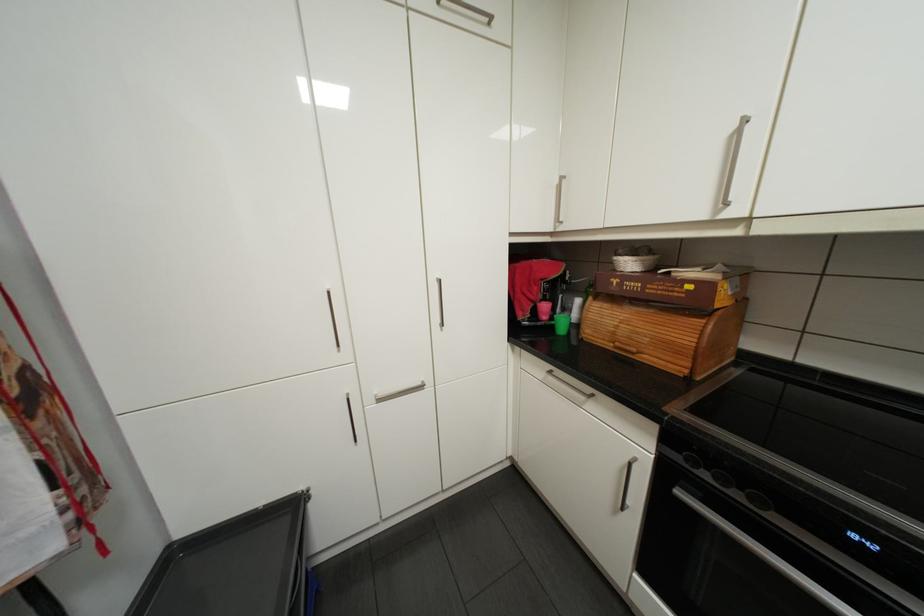
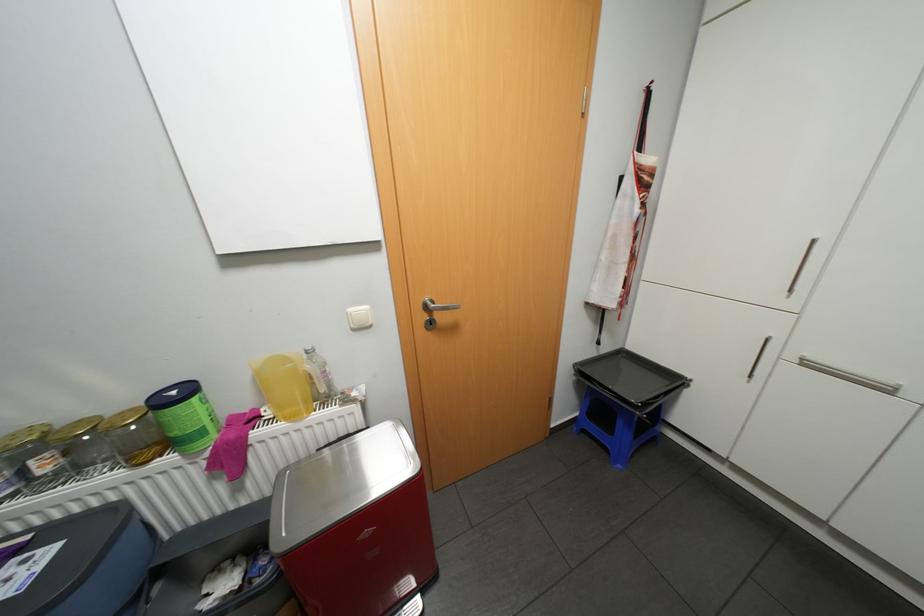
Where in the second image is the point corresponding to point 300,507 from the first image?

(684, 379)